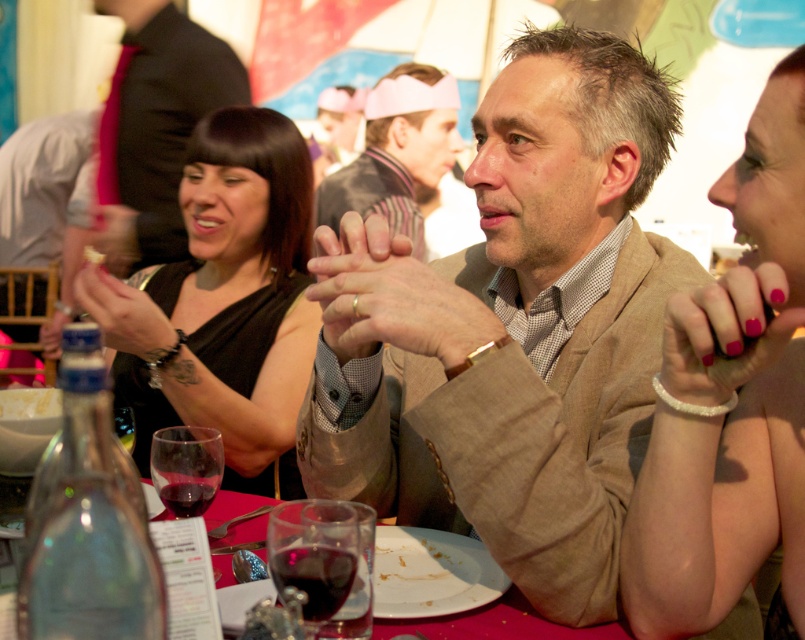
Question: Estimate the real-world distances between objects in this image. Which object is closer to the translucent glass wine at table center?

Choices:
 (A) pink nail polish at upper right
 (B) transparent glass at lower center

Answer: (B)

Question: Which of the following is the farthest from the observer?

Choices:
 (A) white beaded bracelet at upper right
 (B) pink fabric headband at center

Answer: (B)

Question: Which object appears farthest from the camera in this image?

Choices:
 (A) black matte dress at center
 (B) pink fabric headband at center
 (C) white beaded bracelet at upper right
 (D) translucent glass wine at table center

Answer: (B)

Question: Is pink nail polish at upper right to the right of translucent glass wine at table center from the viewer's perspective?

Choices:
 (A) no
 (B) yes

Answer: (B)

Question: Is the position of tan textured blazer at center more distant than that of transparent glass at lower center?

Choices:
 (A) no
 (B) yes

Answer: (B)

Question: Does white beaded bracelet at upper right appear on the left side of matte gold ring at center?

Choices:
 (A) no
 (B) yes

Answer: (A)